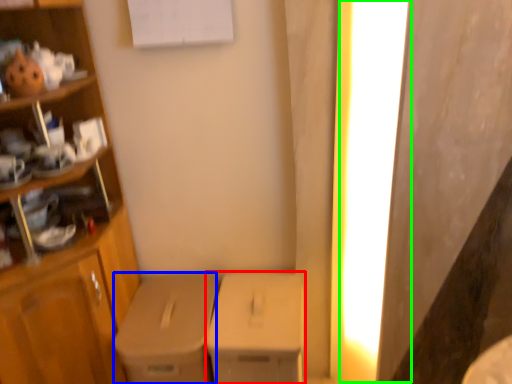
Question: Which object is positioned closest to cardboard box (highlighted by a red box)? Select from cardboard box (highlighted by a blue box) and lighting (highlighted by a green box).

Choices:
 (A) cardboard box
 (B) lighting

Answer: (A)